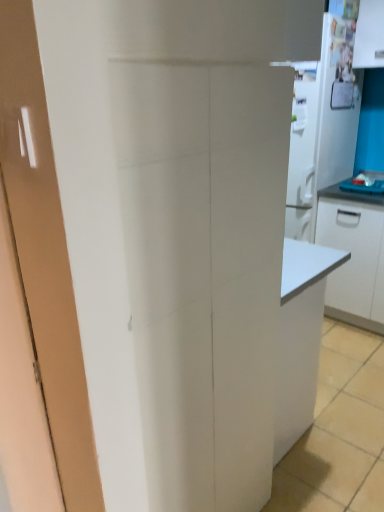
Question: Is white glossy refrigerator at upper right at the right side of white glossy cabinet at right?

Choices:
 (A) no
 (B) yes

Answer: (A)

Question: Would you say white glossy refrigerator at upper right is outside white glossy cabinet at right?

Choices:
 (A) no
 (B) yes

Answer: (B)

Question: Can you confirm if white glossy refrigerator at upper right is bigger than white glossy cabinet at right?

Choices:
 (A) no
 (B) yes

Answer: (B)

Question: Does white glossy refrigerator at upper right have a greater width compared to white glossy cabinet at right?

Choices:
 (A) no
 (B) yes

Answer: (B)

Question: Does white glossy refrigerator at upper right have a lesser width compared to white glossy cabinet at right?

Choices:
 (A) no
 (B) yes

Answer: (A)

Question: In terms of height, does white glossy refrigerator at upper right look taller or shorter compared to white glossy cabinet at right?

Choices:
 (A) tall
 (B) short

Answer: (A)

Question: Does point (342, 68) appear closer or farther from the camera than point (355, 321)?

Choices:
 (A) farther
 (B) closer

Answer: (B)

Question: Looking at their shapes, would you say white glossy refrigerator at upper right is wider or thinner than white glossy cabinet at right?

Choices:
 (A) thin
 (B) wide

Answer: (B)

Question: Is white glossy refrigerator at upper right to the left or to the right of white glossy cabinet at right in the image?

Choices:
 (A) right
 (B) left

Answer: (B)

Question: In terms of width, does blue laminate countertop at right look wider or thinner when compared to white glossy refrigerator at upper right?

Choices:
 (A) wide
 (B) thin

Answer: (B)

Question: In the image, is blue laminate countertop at right positioned in front of or behind white glossy refrigerator at upper right?

Choices:
 (A) behind
 (B) front

Answer: (A)

Question: Based on their positions, is blue laminate countertop at right located to the left or right of white glossy refrigerator at upper right?

Choices:
 (A) right
 (B) left

Answer: (A)

Question: Is blue laminate countertop at right inside or outside of white glossy refrigerator at upper right?

Choices:
 (A) outside
 (B) inside

Answer: (A)

Question: Is white glossy cabinet at right in front of or behind white glossy refrigerator at upper right in the image?

Choices:
 (A) front
 (B) behind

Answer: (B)

Question: Is point (349, 275) closer or farther from the camera than point (319, 159)?

Choices:
 (A) farther
 (B) closer

Answer: (A)